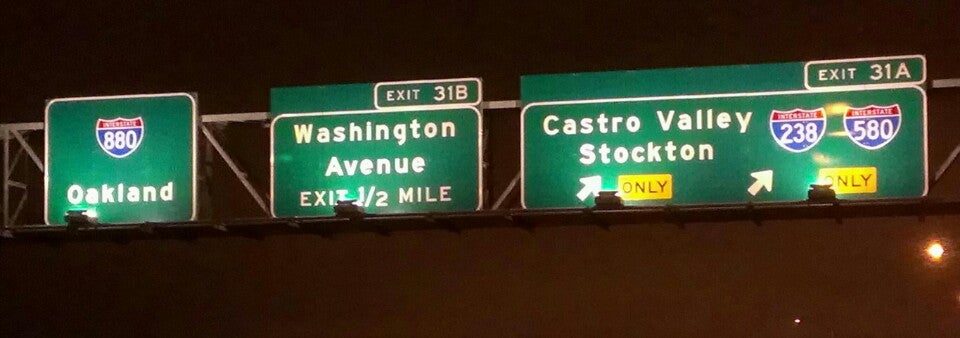
The image size is (960, 338). What are the coordinates of `rod` in the screenshot? It's located at (247, 111).